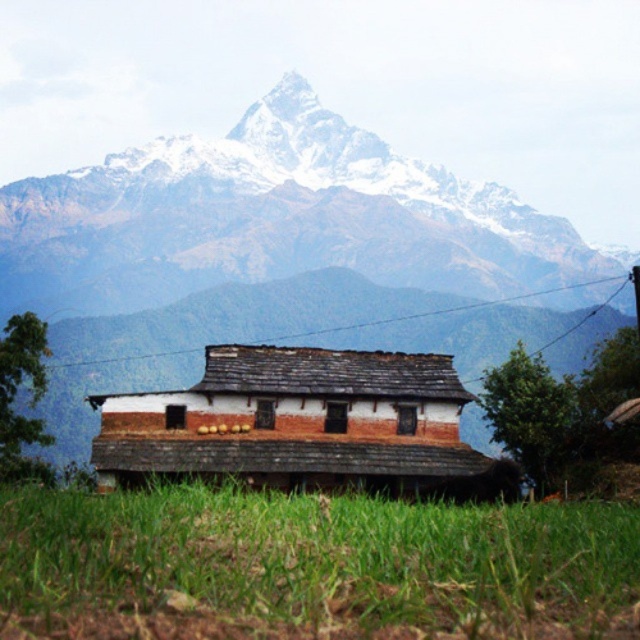
Does green grass at lower center have a smaller size compared to white brick hut at center?

Indeed, green grass at lower center has a smaller size compared to white brick hut at center.

Does green grass at lower center lie in front of white brick hut at center?

Yes, it is.

Is point (618, 538) more distant than point (257, 353)?

That is False.

Where is `green grass at lower center`? The height and width of the screenshot is (640, 640). green grass at lower center is located at coordinates (310, 566).

Does snowy granite mountain range at upper center lie in front of green grass at lower center?

No, it is behind green grass at lower center.

Between point (394, 259) and point (17, 593), which one is positioned behind?

Positioned behind is point (394, 259).

Where is `snowy granite mountain range at upper center`? This screenshot has width=640, height=640. snowy granite mountain range at upper center is located at coordinates (284, 241).

Does point (333, 161) lie behind point (344, 360)?

Yes, it is.

Describe the element at coordinates (284, 241) in the screenshot. I see `snowy granite mountain range at upper center` at that location.

Does point (515, 304) come closer to viewer compared to point (291, 483)?

No, it is behind (291, 483).

Where is `snowy granite mountain range at upper center`? This screenshot has width=640, height=640. snowy granite mountain range at upper center is located at coordinates (284, 241).